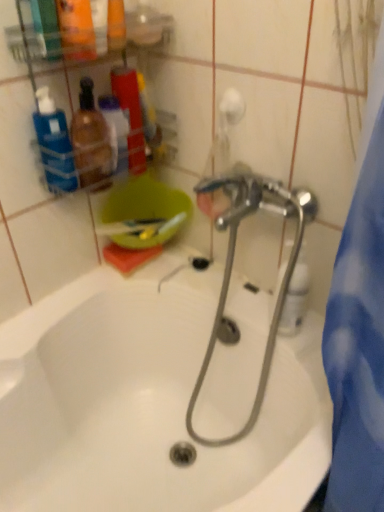
Question: From the image's perspective, is translucent plastic bottles at upper left, which is counted as the 1th toiletry, starting from the right, on top of translucent plastic bottles at left, arranged as the 1th toiletry when viewed from the left?

Choices:
 (A) yes
 (B) no

Answer: (A)

Question: Is translucent plastic bottles at upper left, which is the second toiletry from left to right, positioned beyond the bounds of translucent plastic bottles at left, the 2th toiletry from the right?

Choices:
 (A) yes
 (B) no

Answer: (A)

Question: Considering the relative positions of translucent plastic bottles at upper left, which is counted as the 1th toiletry, starting from the right, and translucent plastic bottles at left, the 2th toiletry from the right, in the image provided, is translucent plastic bottles at upper left, which is counted as the 1th toiletry, starting from the right, behind translucent plastic bottles at left, the 2th toiletry from the right,?

Choices:
 (A) yes
 (B) no

Answer: (A)

Question: From a real-world perspective, is translucent plastic bottles at upper left, which is the second toiletry from left to right, located beneath translucent plastic bottles at left, the 2th toiletry from the right?

Choices:
 (A) no
 (B) yes

Answer: (A)

Question: Is translucent plastic bottles at upper left, which is counted as the 1th toiletry, starting from the right, oriented towards translucent plastic bottles at left, arranged as the 1th toiletry when viewed from the left?

Choices:
 (A) yes
 (B) no

Answer: (B)

Question: Considering the relative positions of translucent plastic bottles at upper left, which is counted as the 1th toiletry, starting from the right, and translucent plastic bottles at left, the 2th toiletry from the right, in the image provided, is translucent plastic bottles at upper left, which is counted as the 1th toiletry, starting from the right, to the left of translucent plastic bottles at left, the 2th toiletry from the right, from the viewer's perspective?

Choices:
 (A) yes
 (B) no

Answer: (B)

Question: From a real-world perspective, does clear plastic spray bottle at center, placed as the 1th cleaning product when sorted from right to left, stand above translucent plastic bottles at left, the 2th toiletry from the right?

Choices:
 (A) yes
 (B) no

Answer: (B)

Question: Does clear plastic spray bottle at center, marked as the 2th cleaning product in a top-to-bottom arrangement, have a larger size compared to translucent plastic bottles at left, the 2th toiletry from the right?

Choices:
 (A) yes
 (B) no

Answer: (B)

Question: Can you confirm if clear plastic spray bottle at center, the first cleaning product ordered from the bottom, is thinner than translucent plastic bottles at left, the 2th toiletry from the right?

Choices:
 (A) yes
 (B) no

Answer: (A)

Question: From a real-world perspective, is clear plastic spray bottle at center, placed as the 1th cleaning product when sorted from right to left, beneath translucent plastic bottles at left, arranged as the 1th toiletry when viewed from the left?

Choices:
 (A) yes
 (B) no

Answer: (A)

Question: Is clear plastic spray bottle at center, the first cleaning product ordered from the bottom, shorter than translucent plastic bottles at left, arranged as the 1th toiletry when viewed from the left?

Choices:
 (A) no
 (B) yes

Answer: (A)

Question: Can you confirm if clear plastic spray bottle at center, the first cleaning product ordered from the bottom, is taller than translucent plastic bottles at left, arranged as the 1th toiletry when viewed from the left?

Choices:
 (A) no
 (B) yes

Answer: (B)

Question: Does translucent plastic bottles at upper left, which is the second toiletry from left to right, have a greater height compared to white glossy bathtub at center?

Choices:
 (A) yes
 (B) no

Answer: (B)